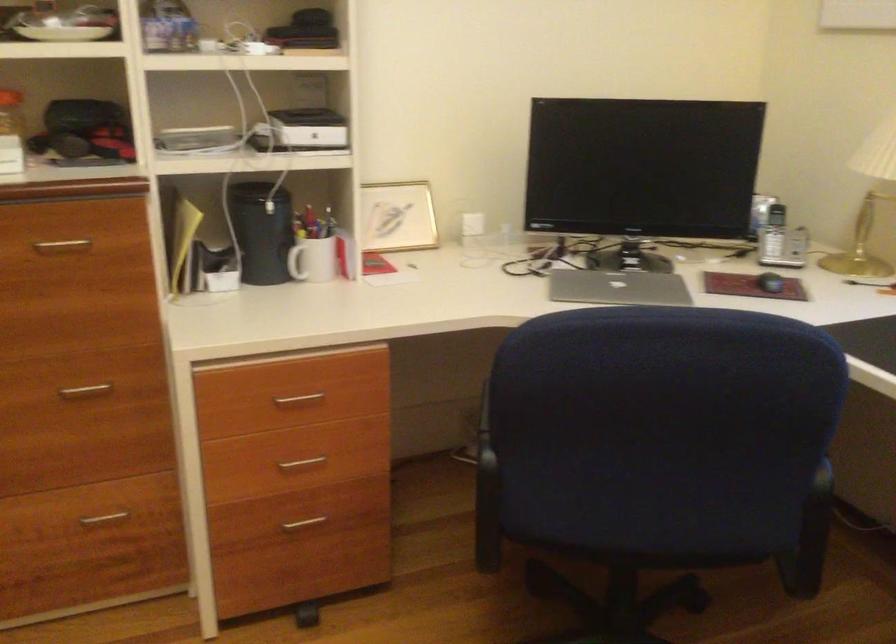
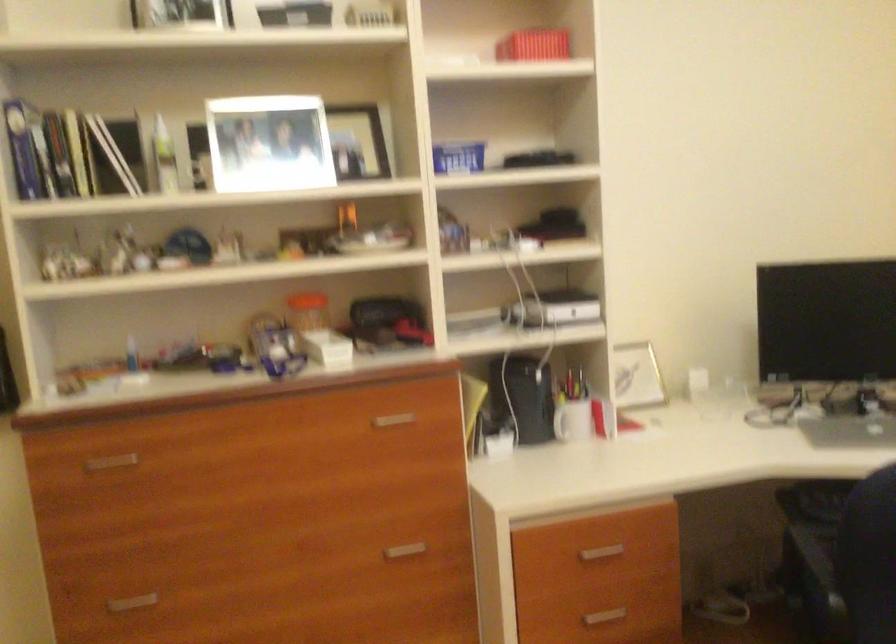
In the second image, find the point that corresponds to (291,257) in the first image.

(560, 422)